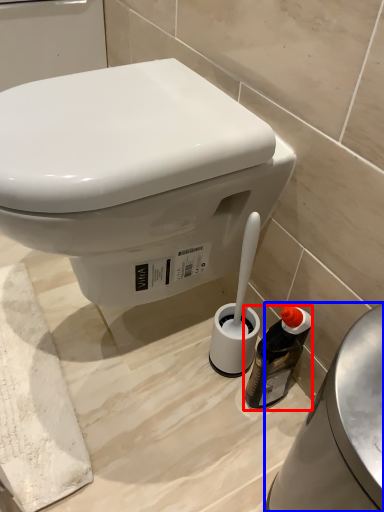
Question: Which point is further to the camera, bottle (highlighted by a red box) or porcelain (highlighted by a blue box)?

Choices:
 (A) bottle
 (B) porcelain

Answer: (A)